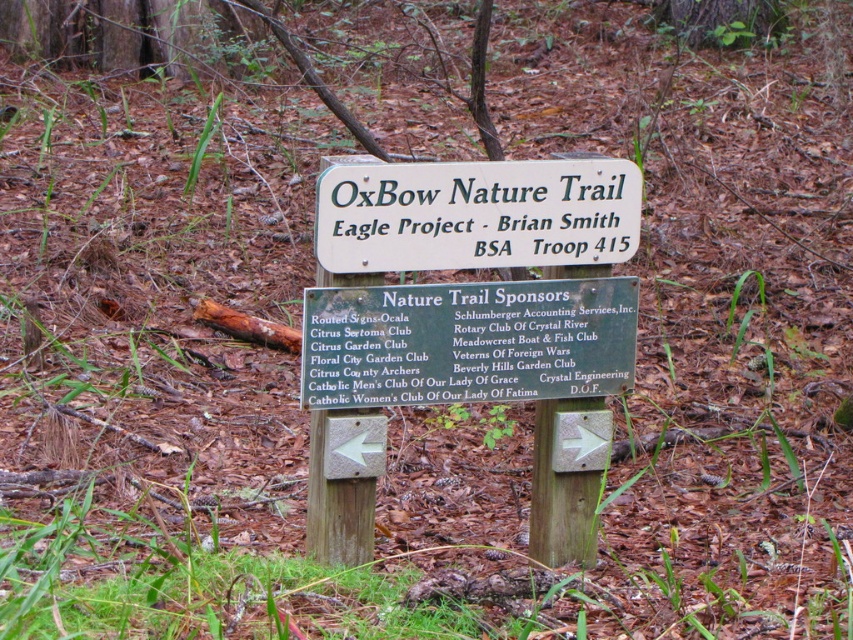
You are a hiker who just arrived at the trailhead and see the green wood sign at center and the white wood sign at center. Which sign is closer to the left side of the trail?

The green wood sign at center is closer to the left side of the trail because it is positioned to the left of the white wood sign at center.

You are a hiker who wants to read the trail name on the signboard. Which sign section should you look at first, the green wood sign at center or the white wood sign at center?

The white wood sign at center is the upper section and contains the trail name, so you should look at the white wood sign at center first.

Consider the image. You are a hiker who just found a trail sign with two sections. The green wood sign at center and the white wood sign at center are part of the same signboard. If you want to place a sticker between them, how much space do you have to work with?

The green wood sign at center and the white wood sign at center are 21.23 centimeters apart from each other, so you have 21.23 centimeters of space between them to place the sticker.